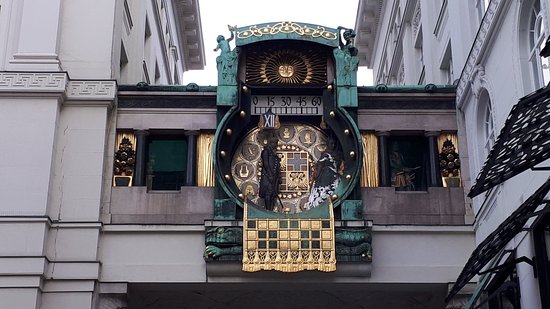
Where is `ledge`? ledge is located at coordinates (43, 80), (74, 86), (480, 57).